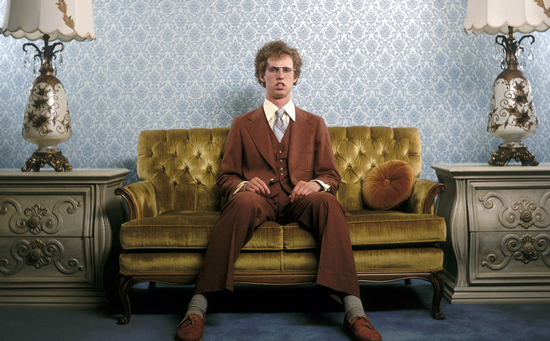
This screenshot has width=550, height=341. In order to click on pillow in this screenshot , I will do `click(404, 171)`.